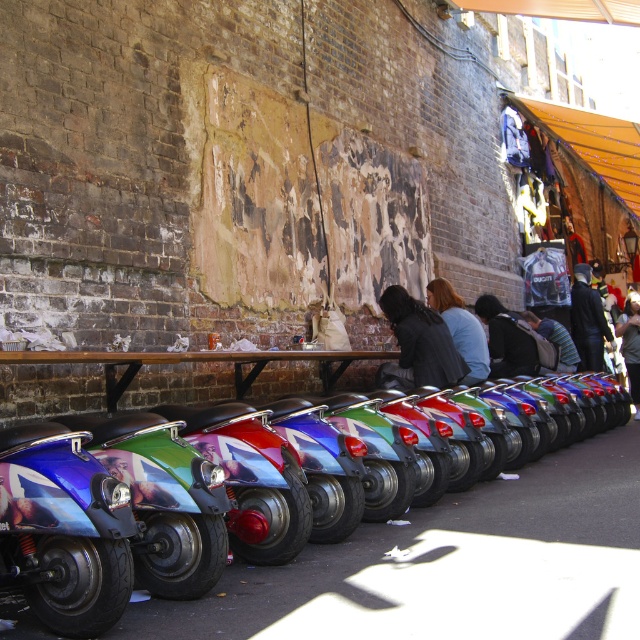
Is point (480, 330) in front of point (579, 333)?

Yes, it is in front of point (579, 333).

Between blue fabric jacket at center and dark blue leather jacket at center, which one appears on the left side from the viewer's perspective?

From the viewer's perspective, blue fabric jacket at center appears more on the left side.

Who is more forward, (461, 339) or (593, 365)?

Positioned in front is point (461, 339).

Where is `blue fabric jacket at center`? The width and height of the screenshot is (640, 640). blue fabric jacket at center is located at coordinates (460, 328).

Can you confirm if metallic multi-colored scooter at center is positioned to the right of dark gray sweater at center?

In fact, metallic multi-colored scooter at center is to the left of dark gray sweater at center.

Can you confirm if metallic multi-colored scooter at center is smaller than dark gray sweater at center?

Yes.

Does point (541, 484) lie in front of point (547, 321)?

Yes.

This screenshot has width=640, height=640. Find the location of `metallic multi-colored scooter at center`. metallic multi-colored scooter at center is located at coordinates (452, 564).

Based on the photo, does shiny metallic scooter at lower left have a smaller size compared to blue fabric jacket at center?

Indeed, shiny metallic scooter at lower left has a smaller size compared to blue fabric jacket at center.

Based on the photo, does shiny metallic scooter at lower left have a lesser height compared to blue fabric jacket at center?

Correct, shiny metallic scooter at lower left is not as tall as blue fabric jacket at center.

Who is more distant from viewer, (109,520) or (484,364)?

Positioned behind is point (484,364).

This screenshot has width=640, height=640. In order to click on shiny metallic scooter at lower left in this screenshot , I will do click(x=64, y=529).